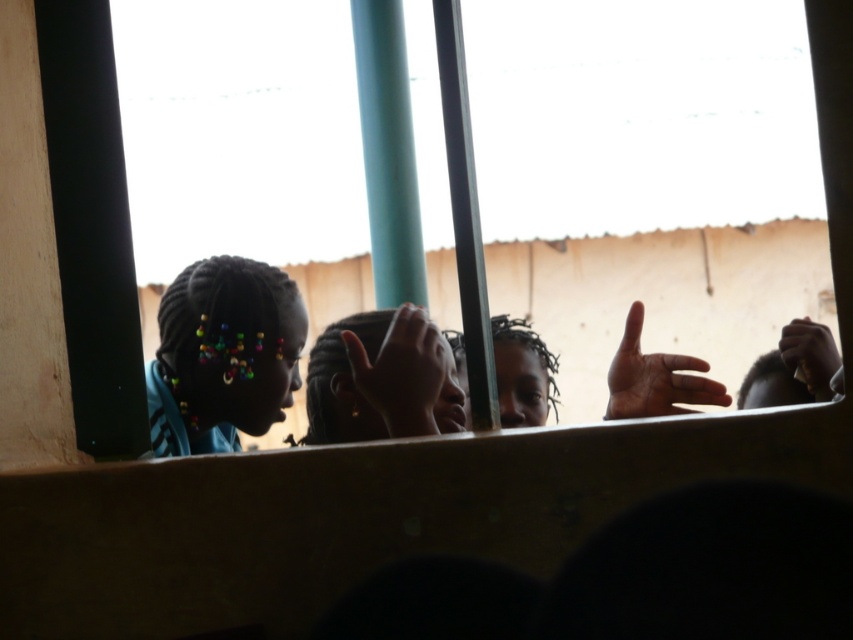
Can you confirm if smooth skin hand at center is smaller than brown matte hand at center?

Incorrect, smooth skin hand at center is not smaller in size than brown matte hand at center.

You are a GUI agent. You are given a task and a screenshot of the screen. Output one action in this format:
    pyautogui.click(x=<x>, y=<y>)
    Task: Click on the smooth skin hand at center
    
    Given the screenshot: What is the action you would take?
    pyautogui.click(x=399, y=381)

Identify the location of smooth skin hand at center. (399, 381).

From the picture: Does transparent glass at upper center have a lesser height compared to smooth skin hand at center?

No.

Is transparent glass at upper center taller than smooth skin hand at center?

Correct, transparent glass at upper center is much taller as smooth skin hand at center.

This screenshot has height=640, width=853. What are the coordinates of `transparent glass at upper center` in the screenshot? It's located at (91, 225).

In the scene shown: Can you confirm if multicolored beaded hair at left is positioned above dark skin hair at center?

No.

Is point (248, 337) positioned after point (502, 356)?

No, it is in front of (502, 356).

Image resolution: width=853 pixels, height=640 pixels. Find the location of `multicolored beaded hair at left`. multicolored beaded hair at left is located at coordinates (223, 355).